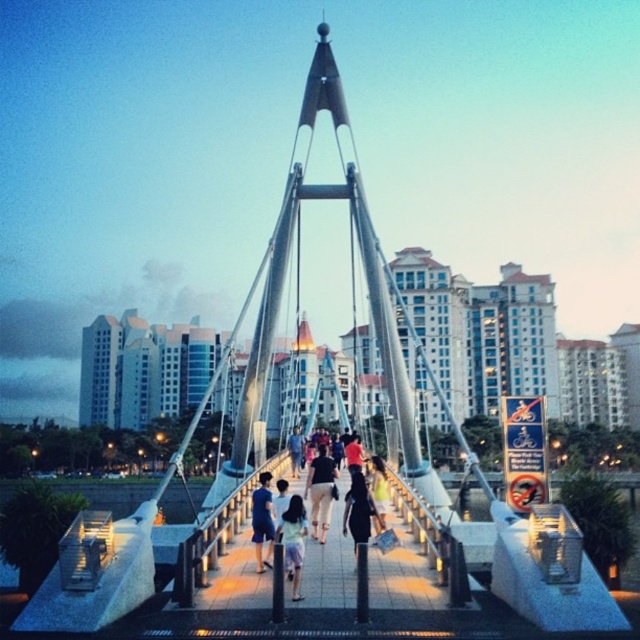
You are a photographer standing on the pedestrian bridge at dusk. You notice two dresses worn by pedestrians at the center of the bridge. The dresses are described as light blue fabric dress at center and black fabric dress at center. Which dress is narrower in width?

The light blue fabric dress at center is narrower in width compared to the black fabric dress at center.

You are a photographer standing on the pedestrian bridge at dusk. You notice two dresses in the crowd at the center of the bridge. The dresses are light blue fabric dress at center and black fabric dress at center. Which dress appears taller?

The light blue fabric dress at center appears taller than the black fabric dress at center.